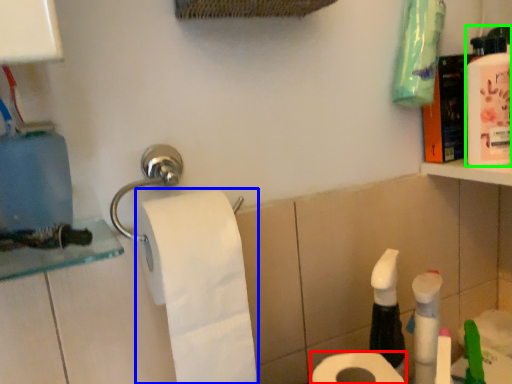
Question: Which object is the farthest from toilet paper (highlighted by a red box)? Choose among these: toilet paper (highlighted by a blue box) or mouthwash (highlighted by a green box).

Choices:
 (A) toilet paper
 (B) mouthwash

Answer: (B)